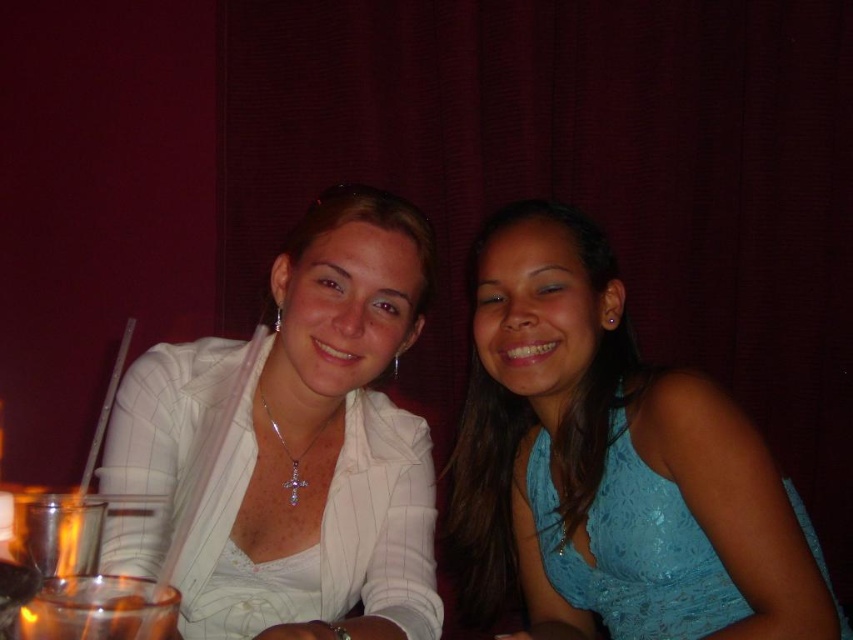
In the scene shown: You are standing in the room and want to locate the blue lace dress at center. According to the coordinates provided, where exactly is it located?

The blue lace dress at center is located at point (612, 465).

You are a photographer taking a portrait of the blue lace dress at center and the white glossy blazer at upper left. Which clothing item appears larger in the photo?

The blue lace dress at center appears larger in the photo because it is much taller than the white glossy blazer at upper left.